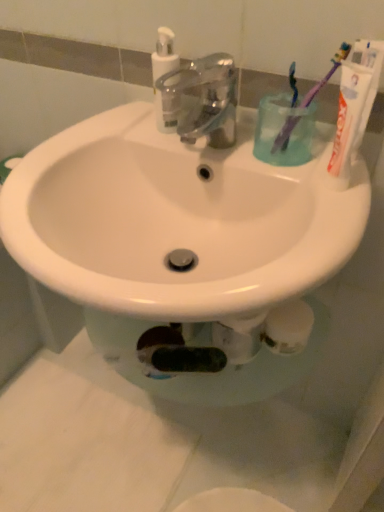
You are a GUI agent. You are given a task and a screenshot of the screen. Output one action in this format:
    pyautogui.click(x=<x>, y=<y>)
    Task: Click on the vacant space in front of purple plastic toothbrush at upper right, acting as the 2th toothbrush starting from the left
    
    Given the screenshot: What is the action you would take?
    pyautogui.click(x=326, y=202)